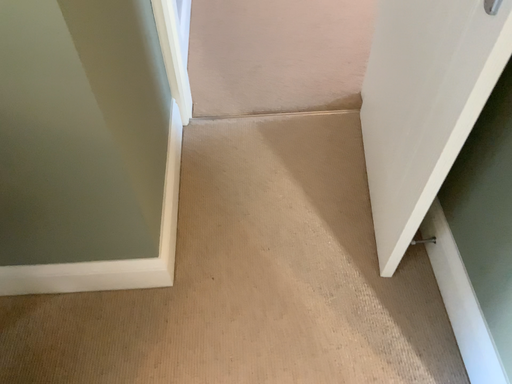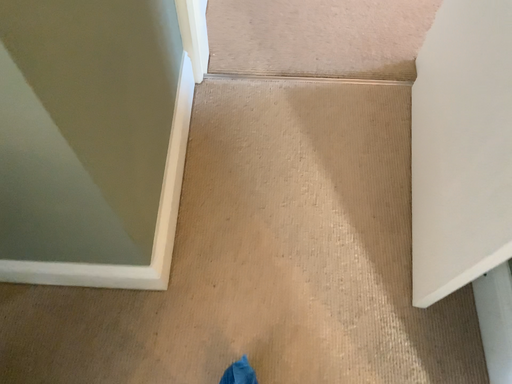
Question: Which way did the camera rotate in the video?

Choices:
 (A) rotated downward
 (B) rotated upward

Answer: (A)